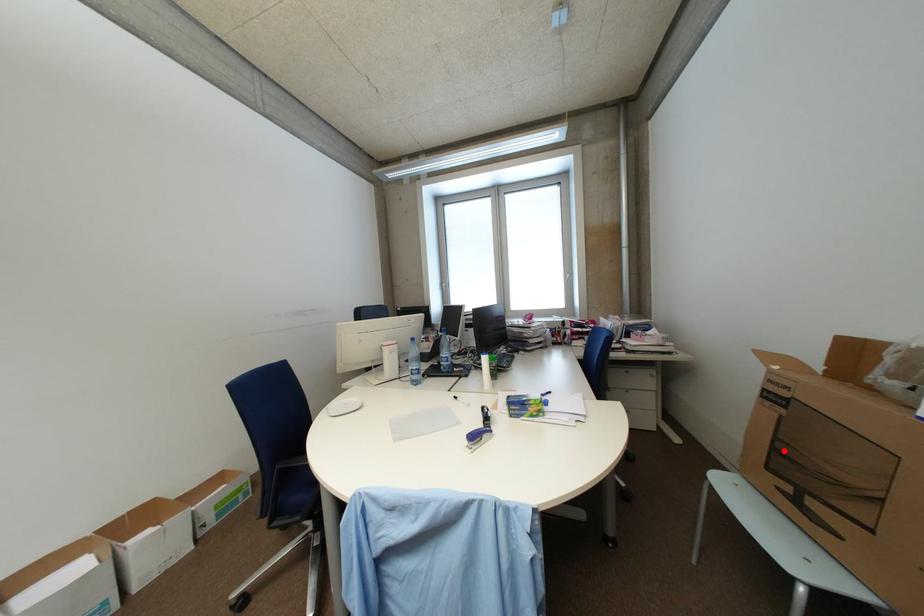
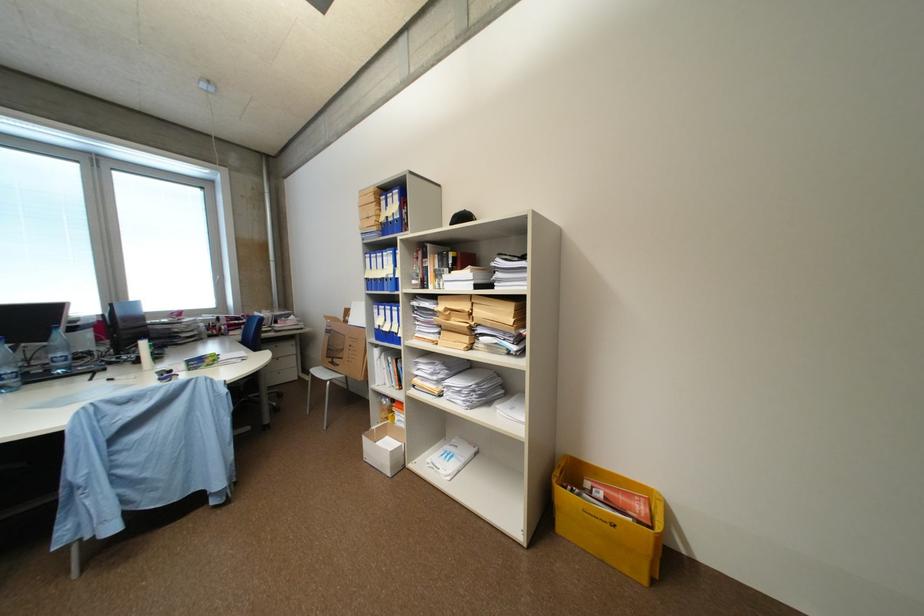
Find the pixel in the second image that matches the highlighted location in the first image.

(336, 350)